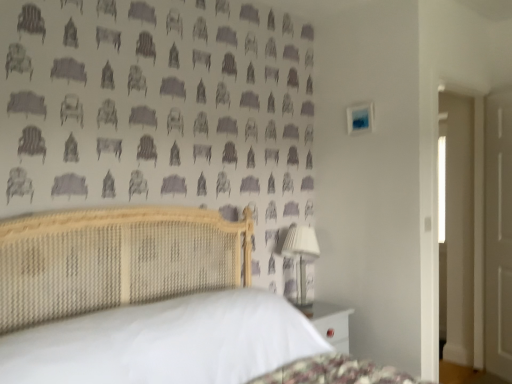
Question: Relative to woven wood bed at center, is white fabric-covered lampshade at right in front or behind?

Choices:
 (A) front
 (B) behind

Answer: (B)

Question: In terms of width, does white fabric-covered lampshade at right look wider or thinner when compared to woven wood bed at center?

Choices:
 (A) wide
 (B) thin

Answer: (B)

Question: Based on their relative distances, which object is farther from the white fabric-covered lampshade at right?

Choices:
 (A) woven wood bed at center
 (B) white matte door at right

Answer: (B)

Question: Based on their relative distances, which object is farther from the white fabric-covered lampshade at right?

Choices:
 (A) woven wood bed at center
 (B) white matte door at right

Answer: (B)